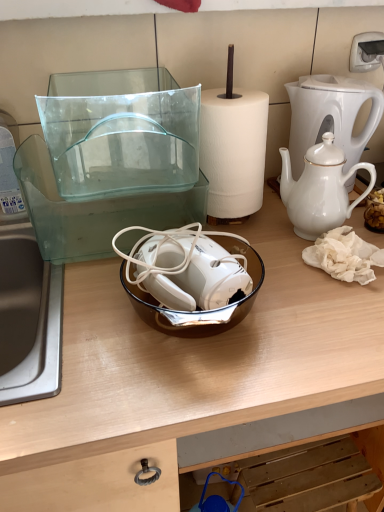
Find the location of a particular element. vacant space positioned to the left of white glossy jar at right is located at coordinates (285, 233).